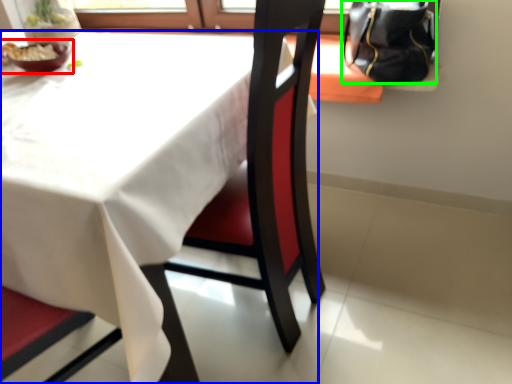
Question: Based on their relative distances, which object is nearer to tableware (highlighted by a red box)? Choose from table (highlighted by a blue box) and handbag (highlighted by a green box).

Choices:
 (A) table
 (B) handbag

Answer: (A)